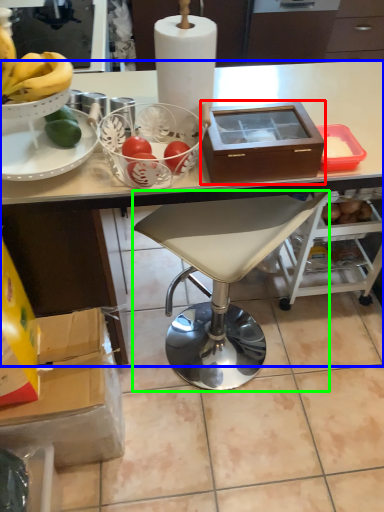
Question: Based on their relative distances, which object is farther from box (highlighted by a red box)? Choose from desk (highlighted by a blue box) and chair (highlighted by a green box).

Choices:
 (A) desk
 (B) chair

Answer: (B)